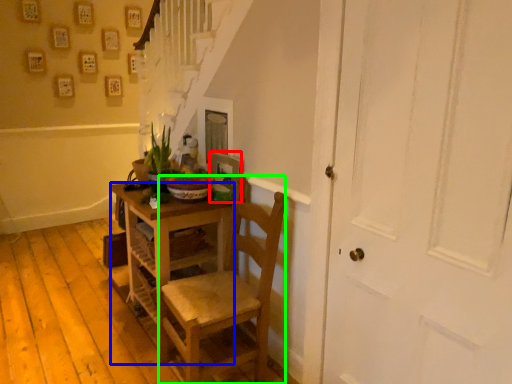
Question: Which object is positioned closest to picture frame (highlighted by a red box)? Select from desk (highlighted by a blue box) and chair (highlighted by a green box).

Choices:
 (A) desk
 (B) chair

Answer: (A)